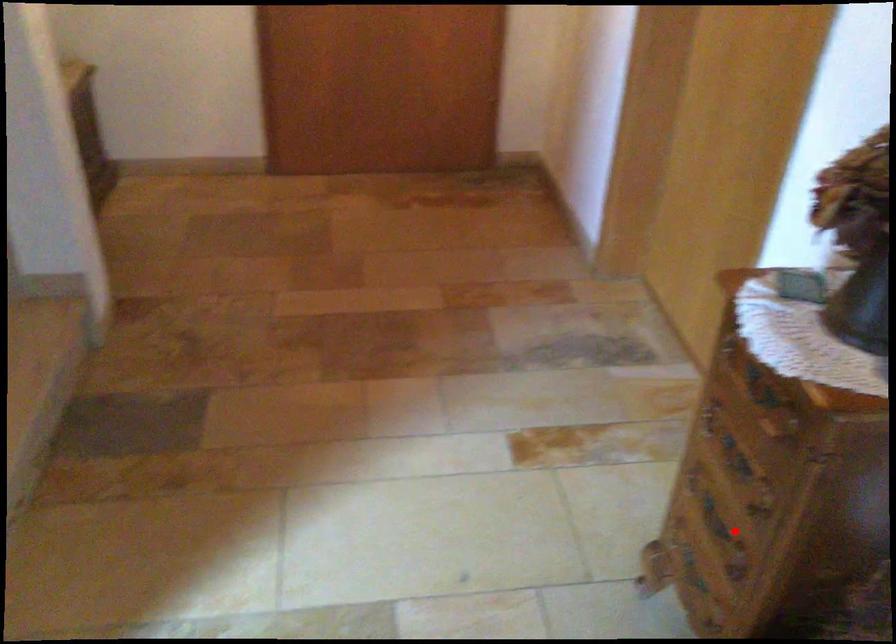
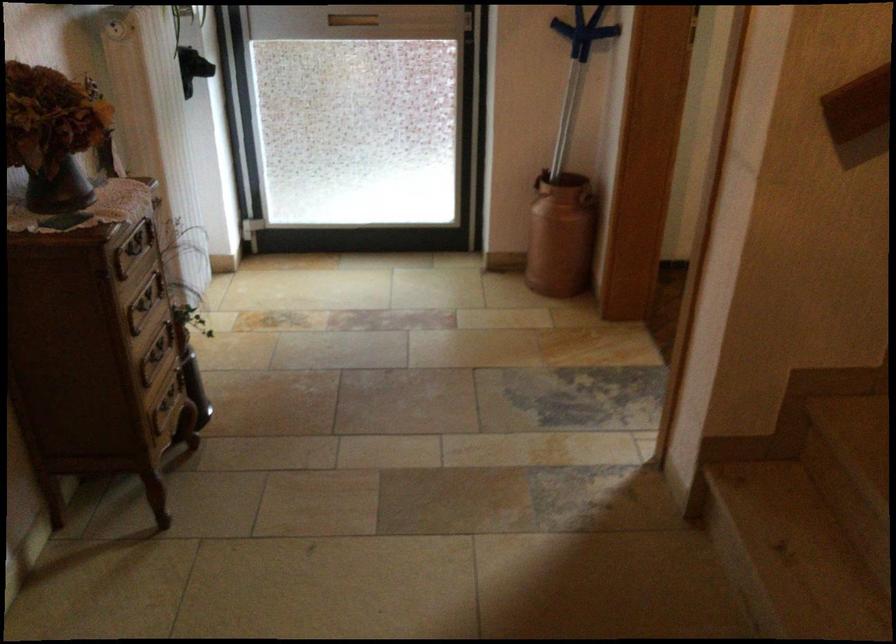
Question: I am providing you with two images of the same scene from different viewpoints. In image1, a red point is highlighted. Considering the same 3D point in image2, which of the following is correct?

Choices:
 (A) It is closer
 (B) It is farther

Answer: (B)